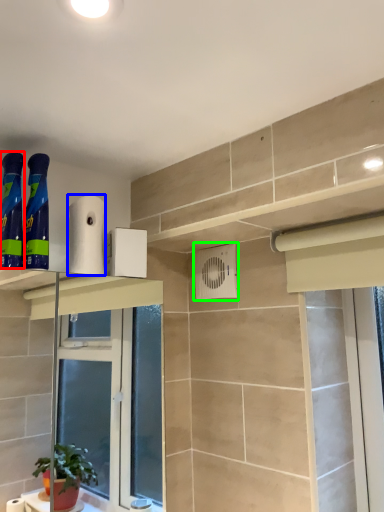
Question: Based on their relative distances, which object is farther from cleaning product (highlighted by a red box)? Choose from toilet paper (highlighted by a blue box) and air conditioning (highlighted by a green box).

Choices:
 (A) toilet paper
 (B) air conditioning

Answer: (B)